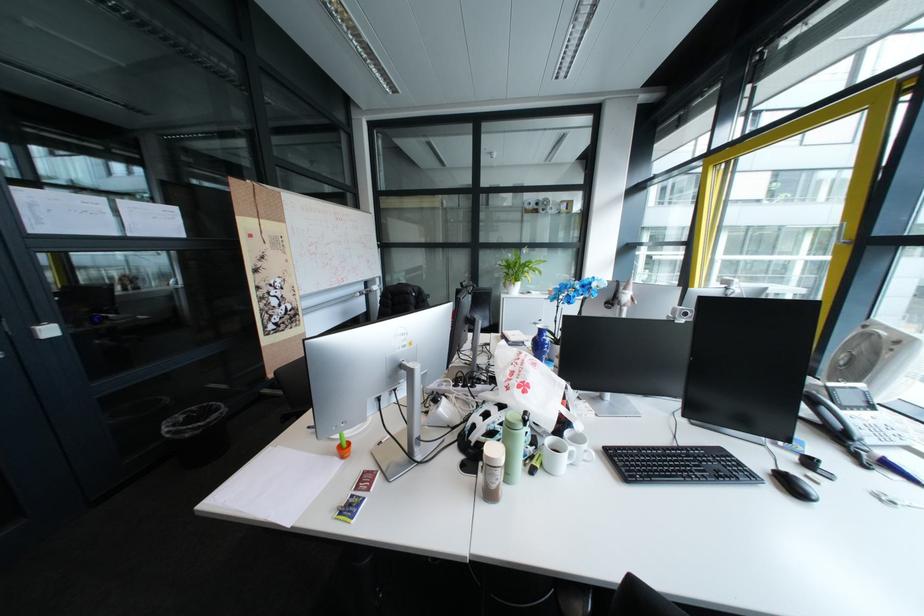
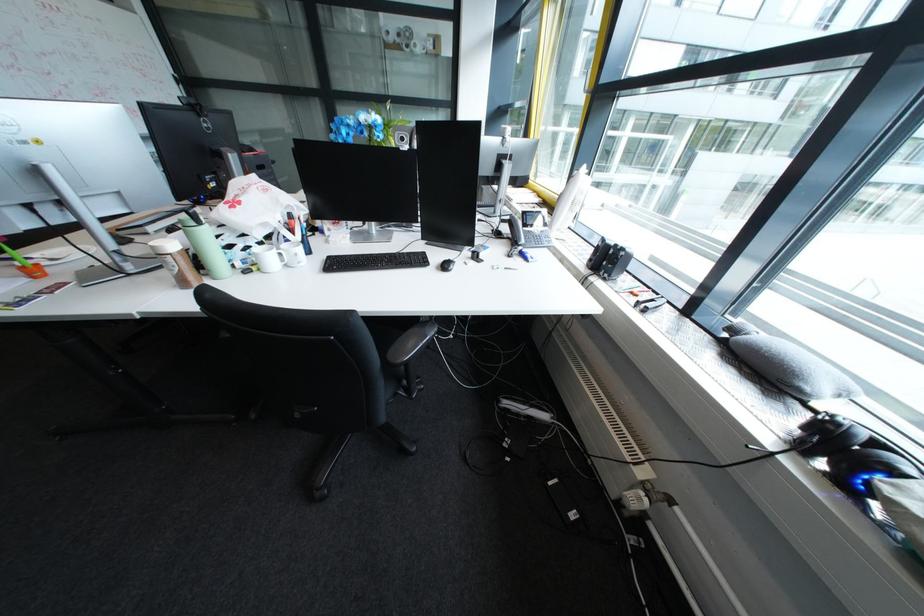
Question: I am providing you with two images of the same scene from different viewpoints. Which of the following objects are not visible in image2?

Choices:
 (A) black computer mouse
 (B) white mug
 (C) vacuum cleaner handle
 (D) chair sitting surface

Answer: (A)